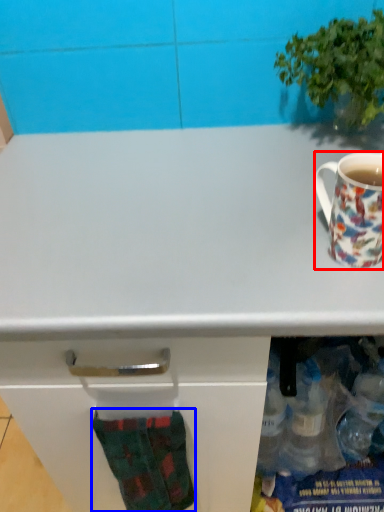
Question: Which point is closer to the camera, coffee cup (highlighted by a red box) or sock (highlighted by a blue box)?

Choices:
 (A) coffee cup
 (B) sock

Answer: (A)